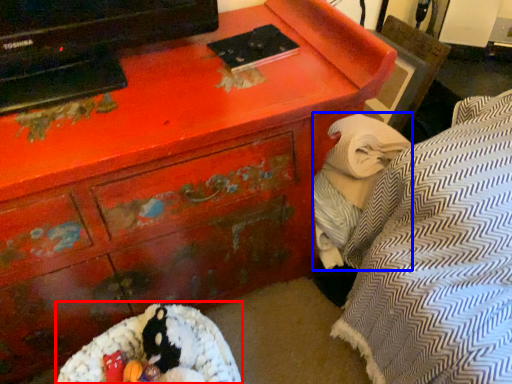
Question: Which point is further to the camera, bean bag chair (highlighted by a red box) or blanket (highlighted by a blue box)?

Choices:
 (A) bean bag chair
 (B) blanket

Answer: (B)